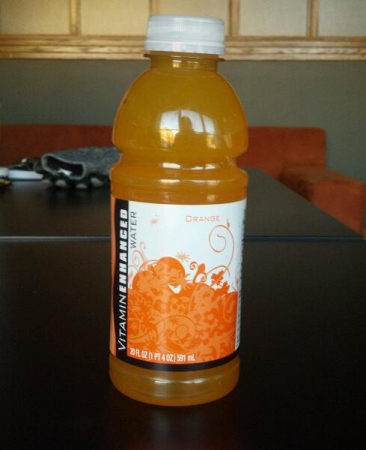
Where is `bottle`? bottle is located at coordinates (216, 188).